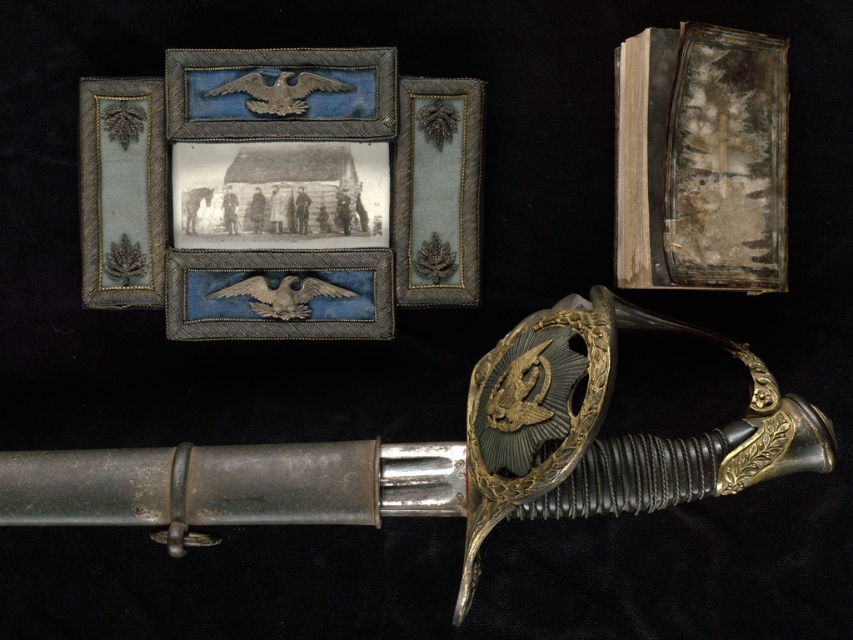
You are an archaeologist examining the artifacts in the image. You need to place a small label next to the distressed paper book at upper right. Where should you place the label in terms of coordinates?

The label should be placed at the coordinates corresponding to the 2D location of the distressed paper book at upper right, which is at point (701, 160).

In the scene shown: You are a museum curator arranging artifacts. You have a polished silver sword at center and a silver textured eagle at center. Which artifact should you place in a larger display case to accommodate their sizes?

The polished silver sword at center has a larger size compared to the silver textured eagle at center, so it should be placed in a larger display case.

You are standing in front of the historical artifacts display. There are two points marked on the image at coordinates point (743, 35) and point (143, 77). Which point is nearer to you?

Point (743, 35) is closer to the viewer than point (143, 77).